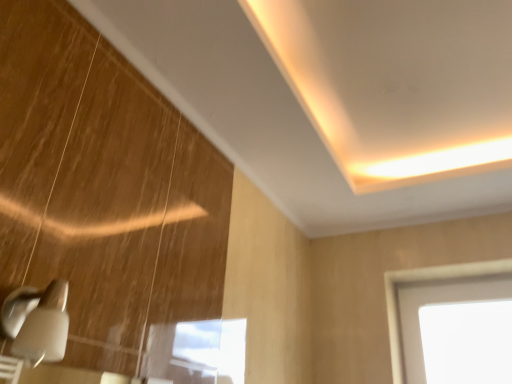
What are the coordinates of `satin silver lamp at lower left` in the screenshot? It's located at 37,322.

Image resolution: width=512 pixels, height=384 pixels. Describe the element at coordinates (37, 322) in the screenshot. I see `satin silver lamp at lower left` at that location.

What is the approximate height of satin silver lamp at lower left?

satin silver lamp at lower left is 10.60 centimeters tall.

Where is `satin silver lamp at lower left`? satin silver lamp at lower left is located at coordinates (37, 322).